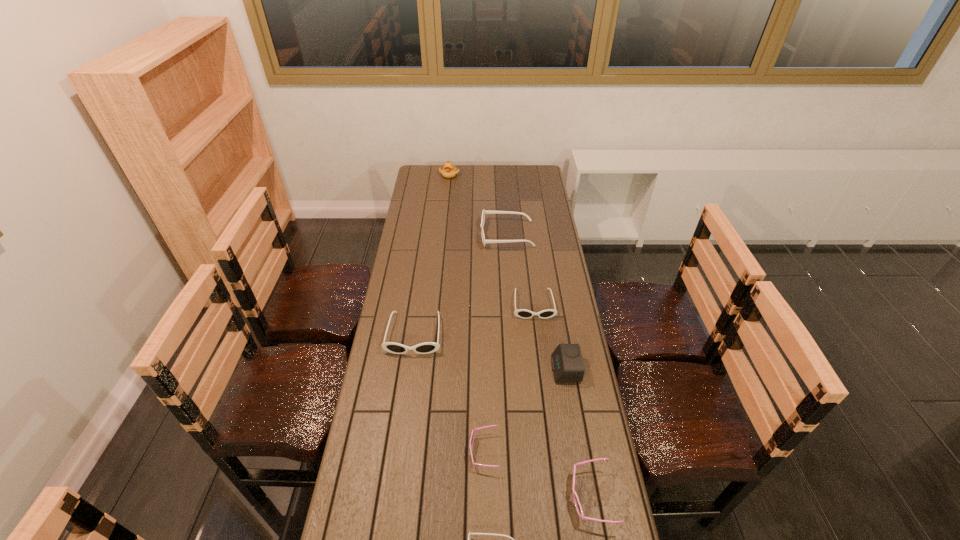
The width and height of the screenshot is (960, 540). What are the coordinates of `vacant area located on the front-facing side of the right pink sunglasses` in the screenshot? It's located at (466, 497).

You are a GUI agent. You are given a task and a screenshot of the screen. Output one action in this format:
    pyautogui.click(x=<x>, y=<y>)
    Task: Click on the vacant space located with the lenses of the second smallest black sunglasses facing outward
    This screenshot has width=960, height=540.
    Given the screenshot: What is the action you would take?
    pyautogui.click(x=545, y=403)

Locate an element on the screen. vacant area situated on the front-facing side of the left pink sunglasses is located at coordinates (416, 451).

Find the location of `free point located 0.250m on the front-facing side of the left pink sunglasses`. free point located 0.250m on the front-facing side of the left pink sunglasses is located at coordinates coord(386,451).

You are a GUI agent. You are given a task and a screenshot of the screen. Output one action in this format:
    pyautogui.click(x=<x>, y=<y>)
    Task: Click on the vacant space located on the front-facing side of the left pink sunglasses
    
    Given the screenshot: What is the action you would take?
    pyautogui.click(x=453, y=451)

The height and width of the screenshot is (540, 960). I want to click on object at the far edge, so click(x=449, y=171).

The height and width of the screenshot is (540, 960). I want to click on duckling located in the left edge section of the desktop, so click(449, 171).

The width and height of the screenshot is (960, 540). In order to click on sunglasses that is positioned at the left edge in this screenshot , I will do `click(428, 347)`.

Find the location of `alarm clock located at the right edge`. alarm clock located at the right edge is located at coordinates (567, 363).

Identify the location of object present at the far left corner. (449, 171).